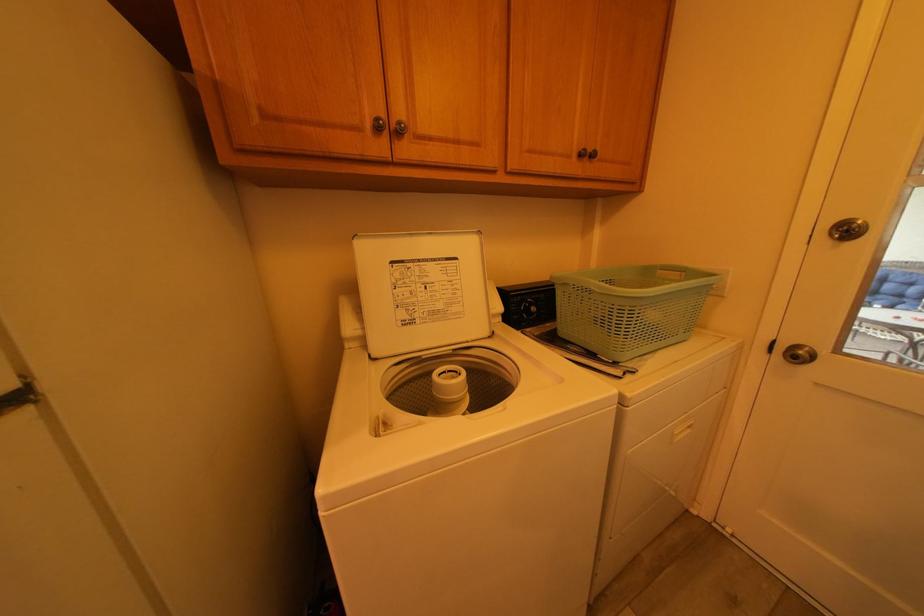
Describe the element at coordinates (539, 312) in the screenshot. I see `the black control dial` at that location.